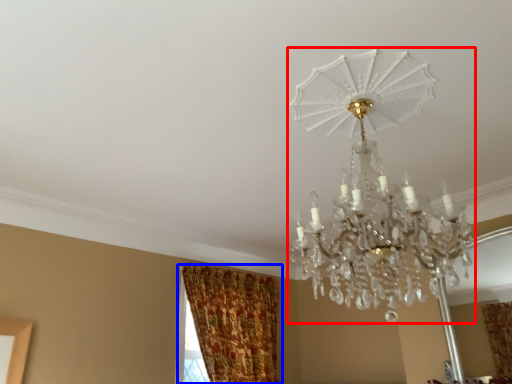
Question: Among these objects, which one is farthest to the camera, lamp (highlighted by a red box) or curtain (highlighted by a blue box)?

Choices:
 (A) lamp
 (B) curtain

Answer: (B)